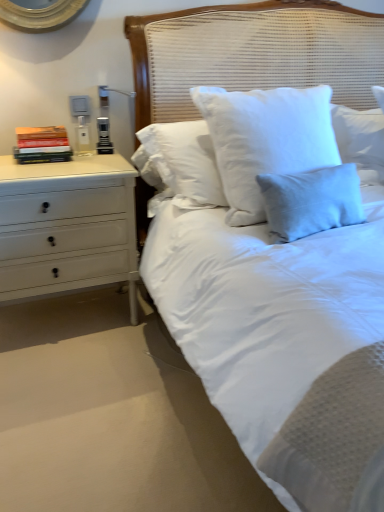
At what (x,y) coordinates should I click in order to perform the action: click on free space above hardcover books at left (from a real-world perspective). Please return your answer as a coordinate pair (x, y). Looking at the image, I should click on (42, 128).